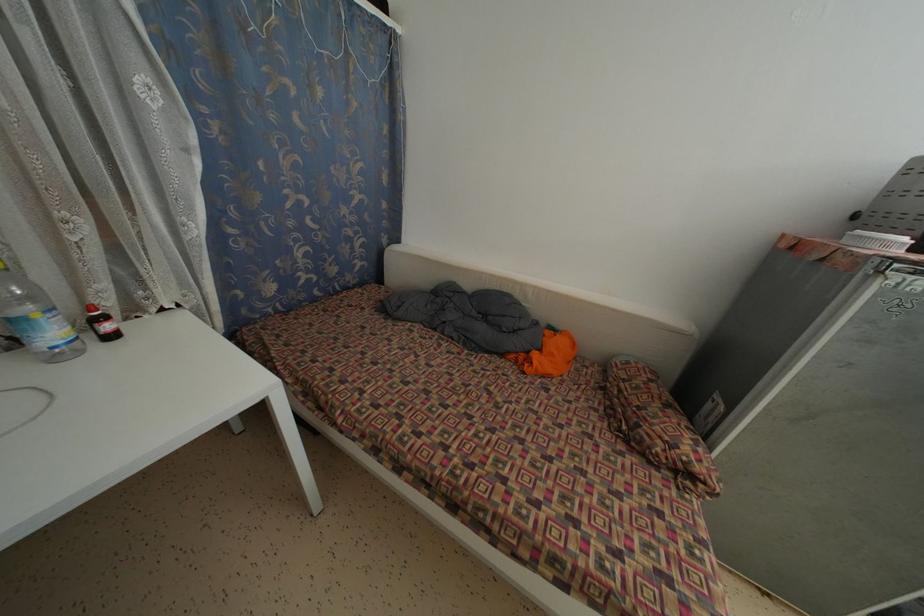
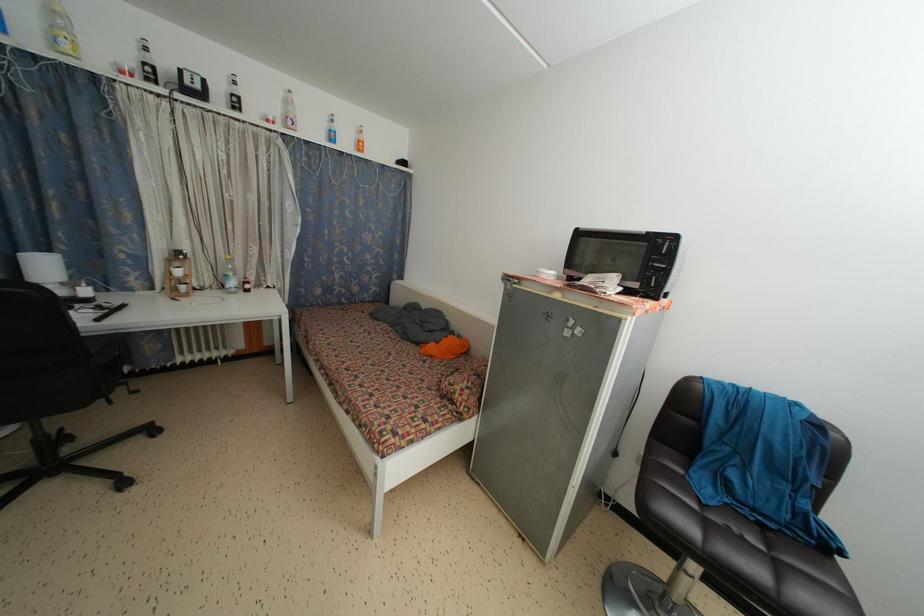
Find the pixel in the second image that matches point 57,339 in the first image.

(237, 289)